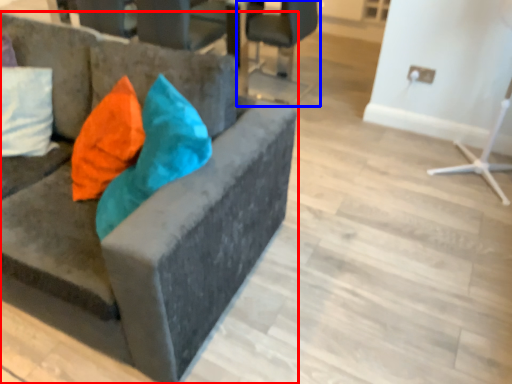
Question: Among these objects, which one is farthest to the camera, chair (highlighted by a red box) or chair (highlighted by a blue box)?

Choices:
 (A) chair
 (B) chair

Answer: (B)